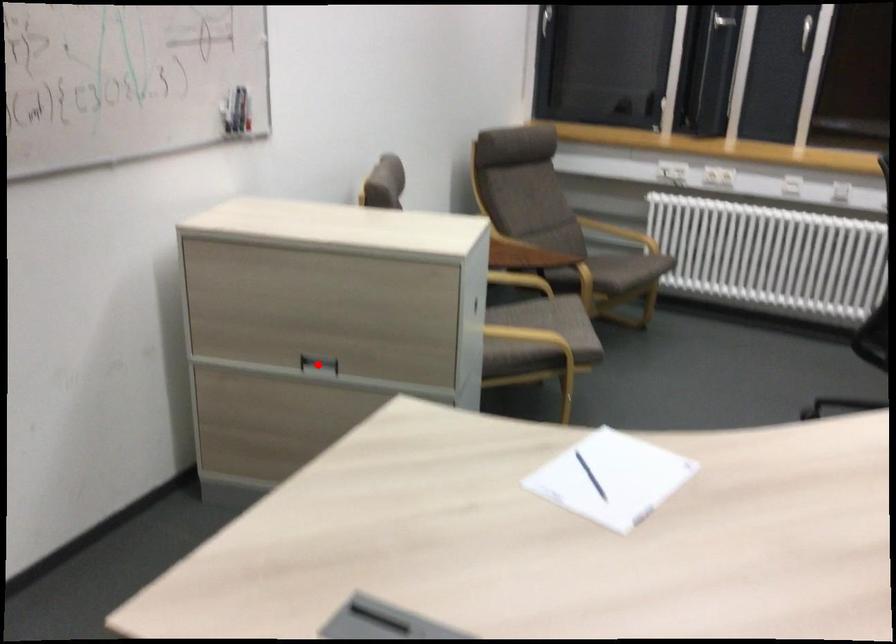
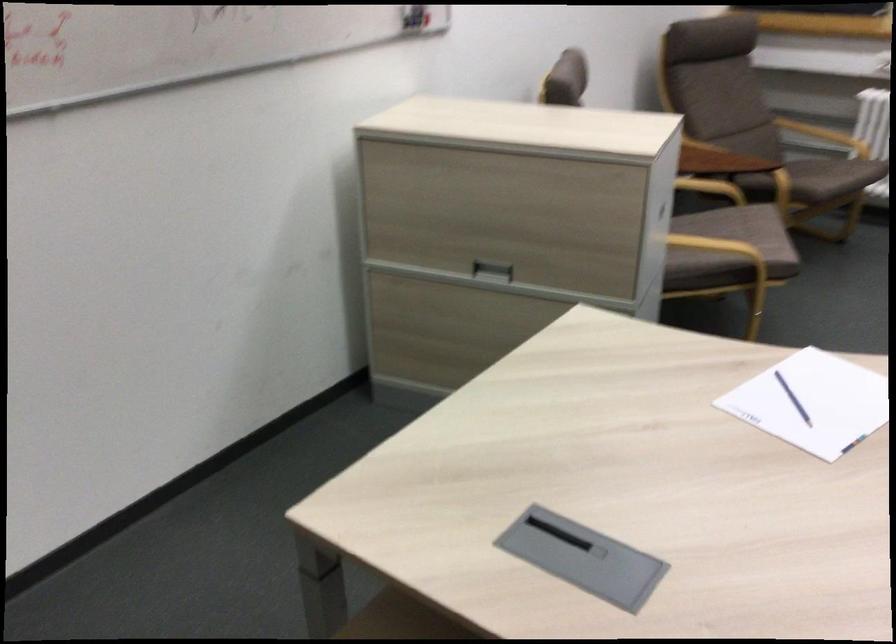
Locate, in the second image, the point that corresponds to the highlighted location in the first image.

(492, 270)